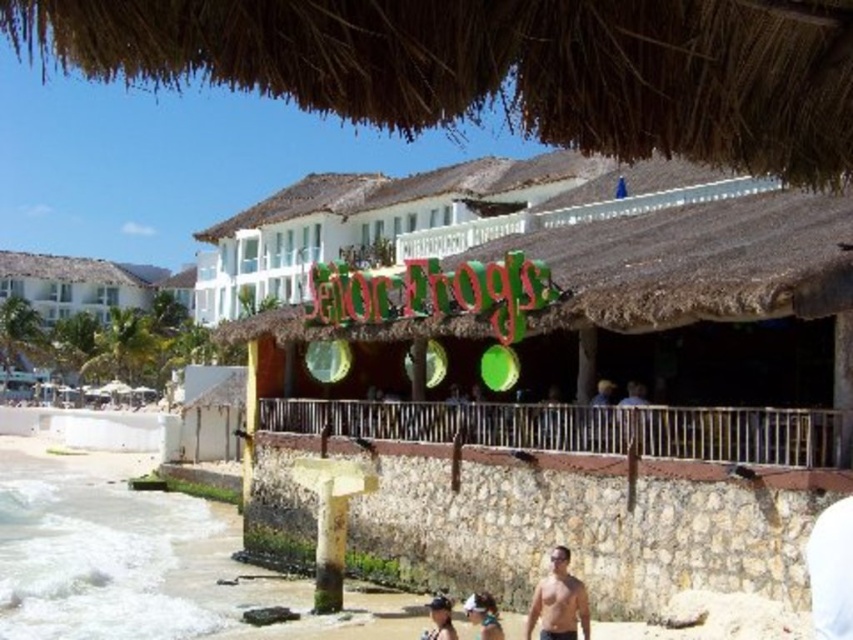
Does smooth skin torso at lower right have a lesser height compared to matte white shirt at lower center?

Yes.

Between point (567, 573) and point (433, 614), which one is positioned in front?

Point (433, 614) is more forward.

Find the location of `smooth skin torso at lower right`. smooth skin torso at lower right is located at coordinates (558, 602).

In the scene shown: Is white fabric visor at lower center bigger than matte white shirt at lower center?

Yes, white fabric visor at lower center is bigger than matte white shirt at lower center.

Does white fabric visor at lower center have a lesser width compared to matte white shirt at lower center?

No.

Locate an element on the screen. white fabric visor at lower center is located at coordinates (483, 616).

The height and width of the screenshot is (640, 853). I want to click on white fabric visor at lower center, so click(483, 616).

Is white fabric visor at lower center to the left of smooth tan skin at center from the viewer's perspective?

Indeed, white fabric visor at lower center is positioned on the left side of smooth tan skin at center.

Can you confirm if white fabric visor at lower center is positioned above smooth tan skin at center?

Incorrect, white fabric visor at lower center is not positioned above smooth tan skin at center.

Find the location of `white fabric visor at lower center`. white fabric visor at lower center is located at coordinates (483, 616).

Locate an element on the screen. Image resolution: width=853 pixels, height=640 pixels. white fabric visor at lower center is located at coordinates (483, 616).